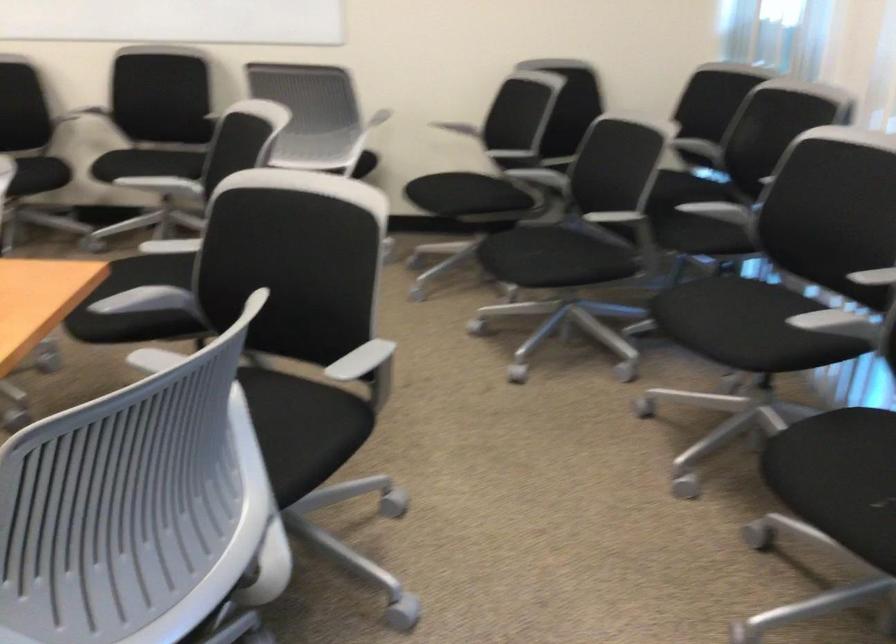
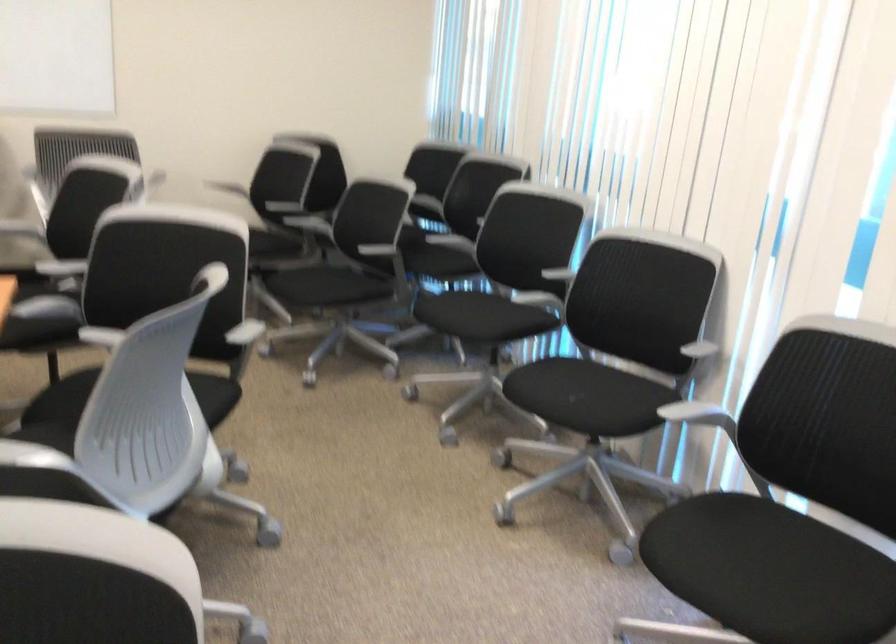
The images are taken continuously from a first-person perspective. In which direction are you moving?

The cameraman walked toward left, backward.